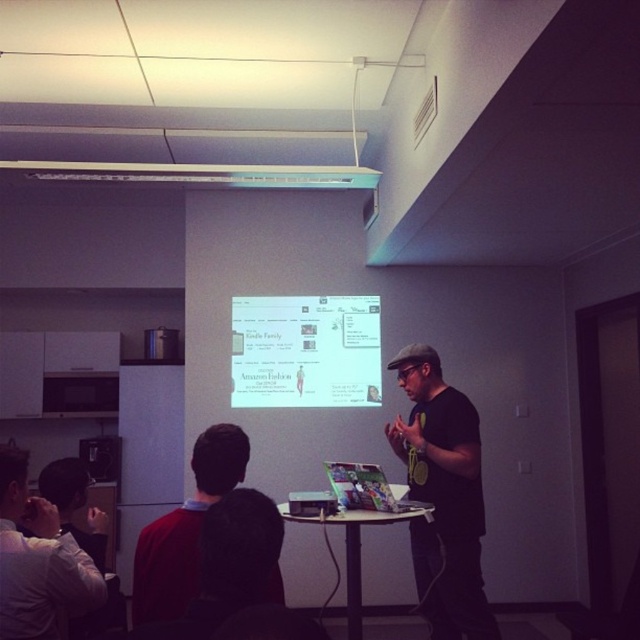
You are standing in the room and want to move to the point at coordinates (250,369). If the room is 10 meters long, can you reach that point without crossing the room entirely?

The distance of point (250,369) from camera is 5.11 meters. Since the room is 10 meters long, you can reach that point without crossing the entire room as it is halfway.

You are a person standing at the back of the room and want to check if you can reach the white glossy projection screen at center without disturbing the presenter. The presenter is standing 1.5 meters away from the screen. If you walk straight towards the screen, will you pass by the dark brown hair at center before reaching the screen?

The white glossy projection screen at center and dark brown hair at center are 3.12 meters apart. Since the presenter is 1.5 meters away from the screen, you would pass the dark brown hair at center, which is 3.12 meters away from the screen, after reaching the screen. Therefore, you would reach the screen before encountering the dark brown hair at center.